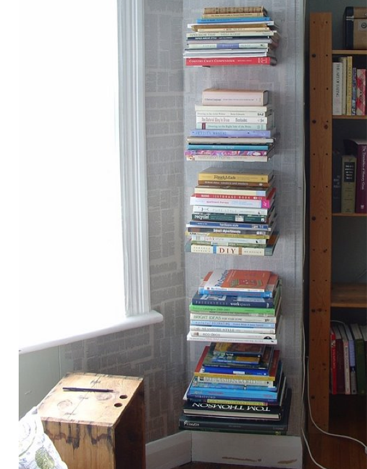
Identify the location of books on the wooden bookshelf. Image resolution: width=367 pixels, height=469 pixels. (347, 90), (354, 178), (346, 373).